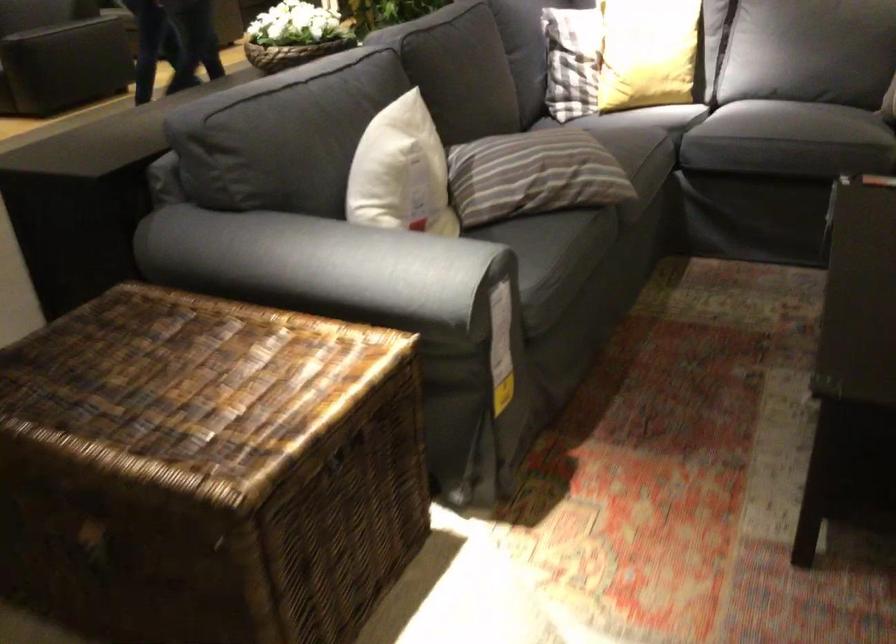
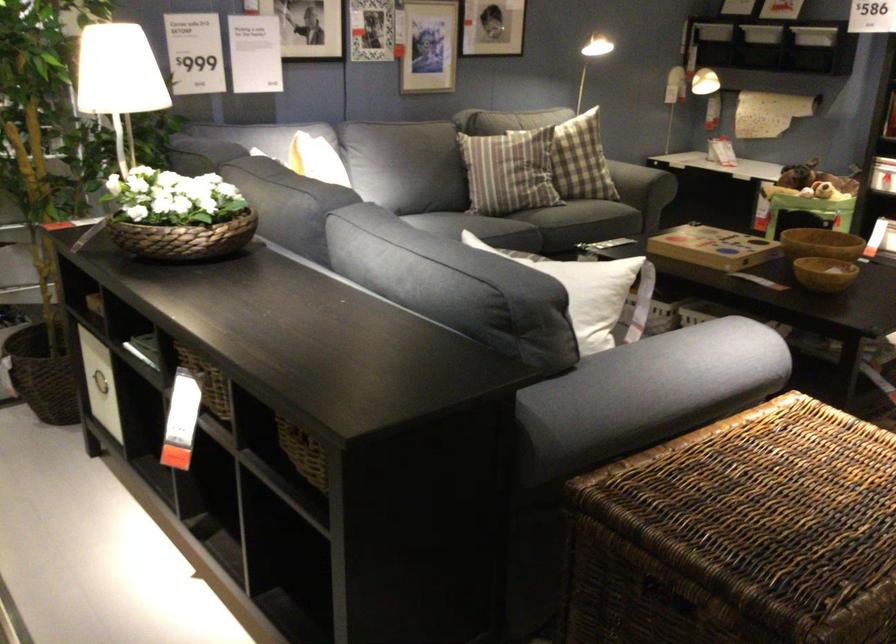
The point at (383,162) is marked in the first image. Where is the corresponding point in the second image?

(581, 272)